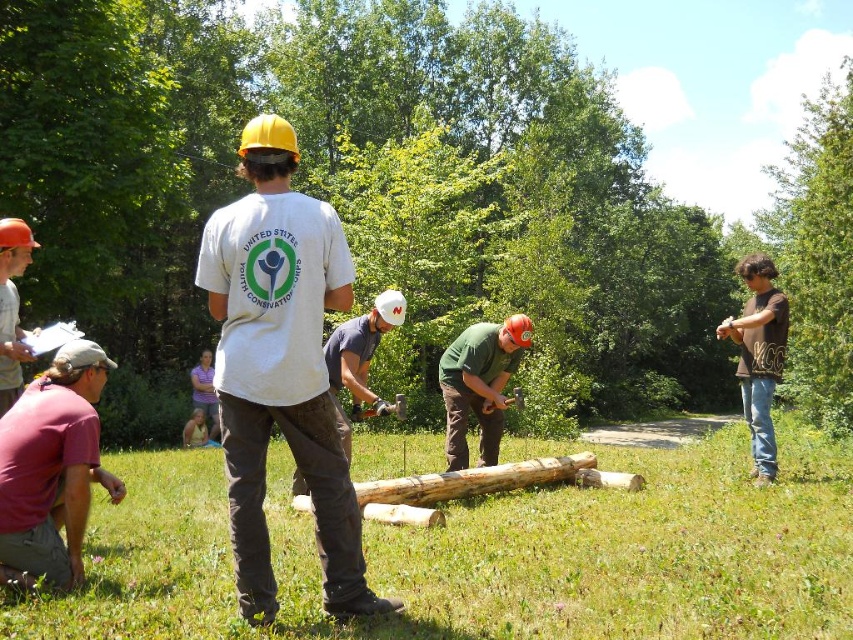
Question: From the image, what is the correct spatial relationship of dark gray cotton shirt at center in relation to matte orange hard hat at left?

Choices:
 (A) below
 (B) above

Answer: (A)

Question: From the image, what is the correct spatial relationship of green grass at lower center in relation to white matte t-shirt at center?

Choices:
 (A) above
 (B) below

Answer: (B)

Question: Is the position of green wood log at center more distant than that of maroon cotton shirt at lower left?

Choices:
 (A) yes
 (B) no

Answer: (A)

Question: Among these points, which one is nearest to the camera?

Choices:
 (A) (212, 188)
 (B) (383, 305)

Answer: (B)

Question: Which point is closer to the camera?

Choices:
 (A) (502, 387)
 (B) (265, 131)
 (C) (335, 385)

Answer: (B)

Question: Among these objects, which one is nearest to the camera?

Choices:
 (A) white matte t-shirt at center
 (B) maroon cotton shirt at lower left

Answer: (A)